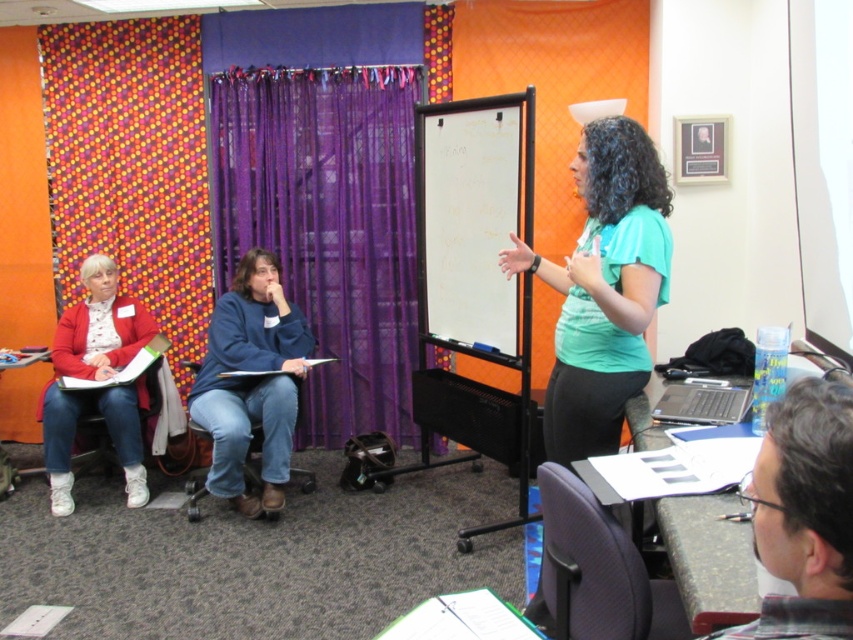
Who is higher up, purple fabric chair at lower right or white fabric chair at left?

Positioned higher is white fabric chair at left.

Can you confirm if purple fabric chair at lower right is shorter than white fabric chair at left?

Indeed, purple fabric chair at lower right has a lesser height compared to white fabric chair at left.

Is point (670, 586) closer to viewer compared to point (79, 454)?

Yes.

Image resolution: width=853 pixels, height=640 pixels. In order to click on purple fabric chair at lower right in this screenshot , I will do `click(598, 570)`.

Which is in front, point (355, 77) or point (469, 227)?

Point (469, 227)

Is purple sheer curtain at center positioned at the back of whiteboard at center?

Yes, it is.

Who is more forward, (358,172) or (426,157)?

Point (426,157) is more forward.

Locate an element on the screen. purple sheer curtain at center is located at coordinates (328, 227).

Can you confirm if whiteboard at center is bigger than plaid fabric shirt at center?

Correct, whiteboard at center is larger in size than plaid fabric shirt at center.

Is point (498, 300) positioned after point (815, 417)?

Yes.

The width and height of the screenshot is (853, 640). I want to click on whiteboard at center, so pyautogui.click(x=473, y=220).